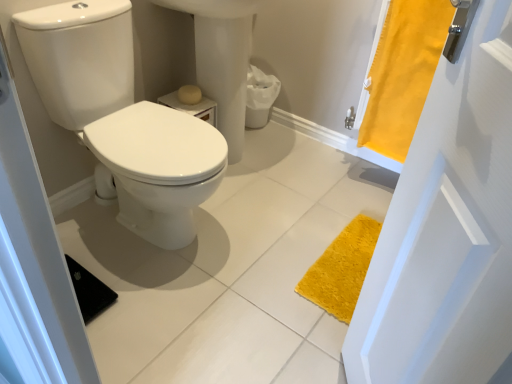
Describe the element at coordinates (403, 73) in the screenshot. I see `yellow fabric curtain at right` at that location.

Find the location of `white glossy sink at center`. white glossy sink at center is located at coordinates (222, 59).

What do you see at coordinates (189, 94) in the screenshot?
I see `matte yellow toilet paper at center` at bounding box center [189, 94].

Measure the distance between point (x=114, y=84) and camera.

1.45 meters.

Where is `yellow fabric curtain at right`? yellow fabric curtain at right is located at coordinates coord(403,73).

Between white glossy sink at center and white glossy toilet at left, which one has less height?

white glossy toilet at left.

Find the location of a particular element. The image size is (512, 384). sink on the right of white glossy toilet at left is located at coordinates (222, 59).

Who is smaller, white glossy sink at center or white glossy toilet at left?

white glossy sink at center is smaller.

Does white glossy sink at center touch white glossy toilet at left?

No, white glossy sink at center is not making contact with white glossy toilet at left.

In the image, is yellow fabric curtain at right positioned in front of or behind white glossy sink at center?

yellow fabric curtain at right is positioned farther from the viewer than white glossy sink at center.

Between yellow fabric curtain at right and white glossy sink at center, which one has smaller size?

With smaller size is yellow fabric curtain at right.

Is point (428, 15) closer or farther from the camera than point (248, 6)?

Clearly, point (428, 15) is closer to the camera than point (248, 6).

Is white glossy sink at center situated inside matte yellow toilet paper at center or outside?

white glossy sink at center exists outside the volume of matte yellow toilet paper at center.

Is white glossy sink at center placed right next to matte yellow toilet paper at center?

No, white glossy sink at center is not with matte yellow toilet paper at center.

How different are the orientations of white glossy sink at center and matte yellow toilet paper at center in degrees?

0.83 degrees.

Does white glossy sink at center turn towards matte yellow toilet paper at center?

Yes, white glossy sink at center faces towards matte yellow toilet paper at center.

I want to click on sink in front of the yellow fabric curtain at right, so click(x=222, y=59).

Is white glossy sink at center to the left or to the right of yellow fabric curtain at right in the image?

Based on their positions, white glossy sink at center is located to the left of yellow fabric curtain at right.

Which object is further away from the camera, white glossy sink at center or yellow fabric curtain at right?

yellow fabric curtain at right is further away from the camera.

From a real-world perspective, which is physically above, white glossy sink at center or yellow fabric curtain at right?

From a 3D spatial view, yellow fabric curtain at right is above.

Is point (184, 87) in front of point (220, 67)?

No, it is not.

Consider the image. How distant is matte yellow toilet paper at center from white glossy sink at center?

The distance of matte yellow toilet paper at center from white glossy sink at center is 8.58 inches.

From a real-world perspective, which is physically below, matte yellow toilet paper at center or white glossy sink at center?

In real-world perspective, matte yellow toilet paper at center is lower.

Is matte yellow toilet paper at center turned away from white glossy sink at center?

Yes, matte yellow toilet paper at center is facing away from white glossy sink at center.

Who is bigger, yellow fabric curtain at right or white glossy toilet at left?

Bigger between the two is white glossy toilet at left.

Is yellow fabric curtain at right positioned far away from white glossy toilet at left?

No, yellow fabric curtain at right is in close proximity to white glossy toilet at left.

Is white glossy toilet at left completely or partially inside yellow fabric curtain at right?

No, white glossy toilet at left is not a part of yellow fabric curtain at right.

From a real-world perspective, is yellow fabric curtain at right beneath white glossy toilet at left?

Actually, yellow fabric curtain at right is physically above white glossy toilet at left in the real world.

Is white glossy toilet at left wider or thinner than white glossy sink at center?

white glossy toilet at left is wider than white glossy sink at center.

In the image, is white glossy toilet at left on the left side or the right side of white glossy sink at center?

In the image, white glossy toilet at left appears on the left side of white glossy sink at center.

Does point (221, 167) come farther from viewer compared to point (239, 96)?

No, it is not.

Where is `toilet that is below the white glossy sink at center (from the image's perspective)`? The image size is (512, 384). toilet that is below the white glossy sink at center (from the image's perspective) is located at coordinates (123, 119).

Where is `sink on the left of the yellow fabric curtain at right`? sink on the left of the yellow fabric curtain at right is located at coordinates (222, 59).

When comparing their distances from yellow fabric curtain at right, does white glossy sink at center or white glossy toilet at left seem further?

Among the two, white glossy toilet at left is located further to yellow fabric curtain at right.

Considering their positions, is white glossy toilet at left positioned closer to yellow fabric curtain at right than white glossy sink at center?

Based on the image, white glossy sink at center appears to be nearer to yellow fabric curtain at right.

Looking at the image, which one is located further to matte yellow toilet paper at center, white glossy sink at center or yellow fabric curtain at right?

yellow fabric curtain at right.

Which object lies nearer to the anchor point white glossy toilet at left, matte yellow toilet paper at center or yellow fabric curtain at right?

matte yellow toilet paper at center.

When comparing their distances from white glossy toilet at left, does yellow fabric curtain at right or matte yellow toilet paper at center seem closer?

The object closer to white glossy toilet at left is matte yellow toilet paper at center.

Estimate the real-world distances between objects in this image. Which object is closer to matte yellow toilet paper at center, yellow fabric curtain at right or white glossy sink at center?

The object closer to matte yellow toilet paper at center is white glossy sink at center.

When comparing their distances from yellow fabric curtain at right, does white glossy toilet at left or matte yellow toilet paper at center seem closer?

matte yellow toilet paper at center is closer to yellow fabric curtain at right.

From the image, which object appears to be nearer to matte yellow toilet paper at center, white glossy toilet at left or yellow fabric curtain at right?

Based on the image, white glossy toilet at left appears to be nearer to matte yellow toilet paper at center.

Locate an element on the screen. The height and width of the screenshot is (384, 512). sink located between white glossy toilet at left and matte yellow toilet paper at center in the depth direction is located at coordinates (222, 59).

Locate an element on the screen. sink between white glossy toilet at left and yellow fabric curtain at right is located at coordinates (222, 59).

The height and width of the screenshot is (384, 512). What are the coordinates of `sink between matte yellow toilet paper at center and yellow fabric curtain at right from left to right` in the screenshot? It's located at (222, 59).

This screenshot has width=512, height=384. In order to click on toilet paper between white glossy toilet at left and yellow fabric curtain at right in this screenshot , I will do `click(189, 94)`.